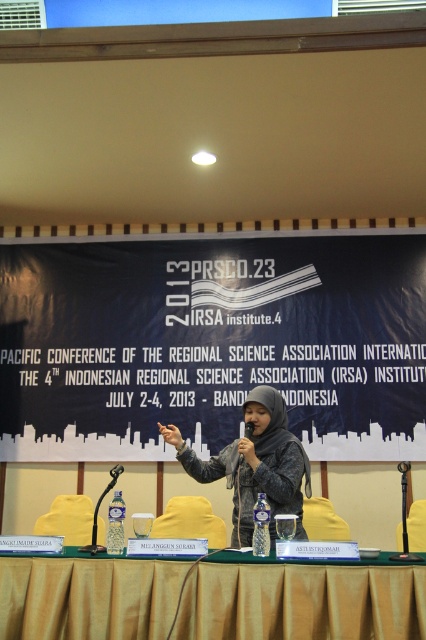
Can you confirm if matte gray hoodie at center is wider than black plastic microphone at center?

Yes, matte gray hoodie at center is wider than black plastic microphone at center.

Does matte gray hoodie at center lie behind black plastic microphone at center?

No, it is not.

Find the location of a particular element. matte gray hoodie at center is located at coordinates (255, 465).

Between gold fabric table at center and black plastic microphone at center, which one has more height?

Standing taller between the two is gold fabric table at center.

Is point (382, 621) positioned before point (250, 422)?

That is True.

What are the coordinates of `gold fabric table at center` in the screenshot? It's located at (302, 602).

Based on the photo, is gold fabric table at center smaller than matte gray hoodie at center?

Yes.

Which is above, gold fabric table at center or matte gray hoodie at center?

Positioned higher is matte gray hoodie at center.

Find the location of `gold fabric table at center`. gold fabric table at center is located at coordinates (302, 602).